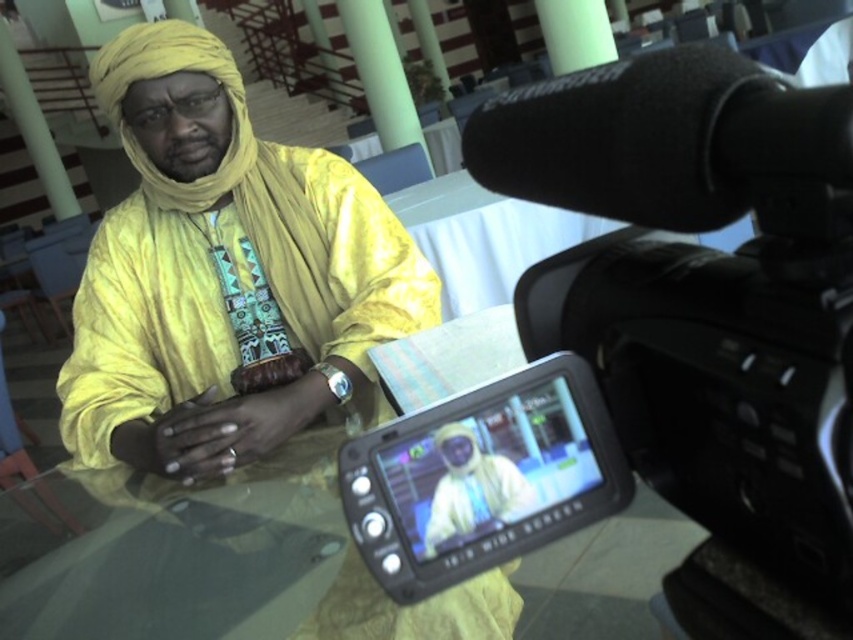
Who is shorter, matte yellow fabric at center or transparent glass table at center?

With less height is transparent glass table at center.

Find the location of a particular element. This screenshot has width=853, height=640. matte yellow fabric at center is located at coordinates (224, 273).

Locate an element on the screen. This screenshot has height=640, width=853. matte yellow fabric at center is located at coordinates (224, 273).

Based on the photo, can you confirm if transparent glass table at center is positioned below matte yellow turban at upper left?

Yes, transparent glass table at center is below matte yellow turban at upper left.

Does point (141, 547) lie in front of point (459, 472)?

No.

Identify the location of transparent glass table at center. The height and width of the screenshot is (640, 853). (166, 560).

Is point (265, 593) positioned after point (585, 396)?

That is True.

Is transparent glass table at center behind black plastic camera at center?

Yes, transparent glass table at center is behind black plastic camera at center.

Is point (184, 627) positioned in front of point (360, 506)?

No, it is behind (360, 506).

This screenshot has width=853, height=640. I want to click on transparent glass table at center, so click(166, 560).